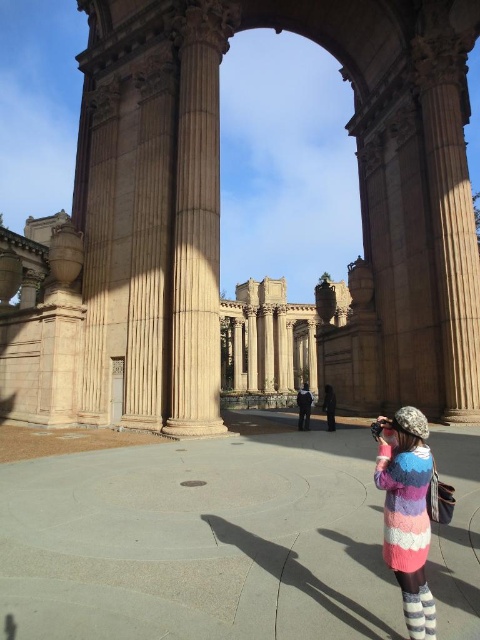
You are standing in the Palace of Fine Arts and see a point at coordinates [407,512]. Based on the scene description, what object is this point located on?

The point is located on the multicolored knitted sweater at lower right.

You are an interior designer observing the Palace of Fine Arts structure. You notice the multicolored knitted sweater at lower right and the dark blue fabric jacket at center. Which item is positioned higher up in the scene?

The multicolored knitted sweater at lower right is located above the dark blue fabric jacket at center, so it is positioned higher up in the scene.

You are an architect visiting the Palace of Fine Arts. You notice the brown stone ruins at center and the dark blue fabric jacket at center. Which object would cast a longer shadow during midday?

The brown stone ruins at center is larger in size than the dark blue fabric jacket at center, so it would cast a longer shadow during midday.